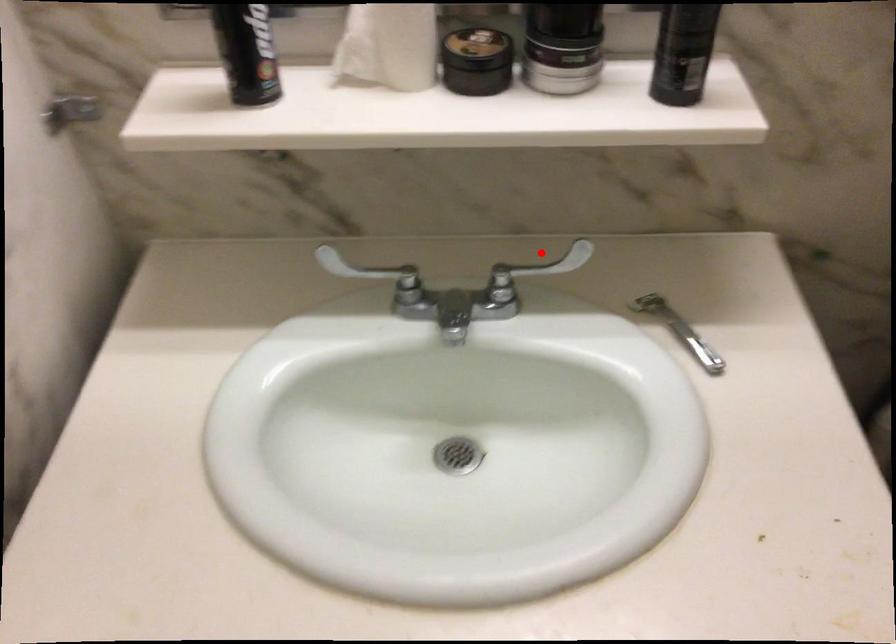
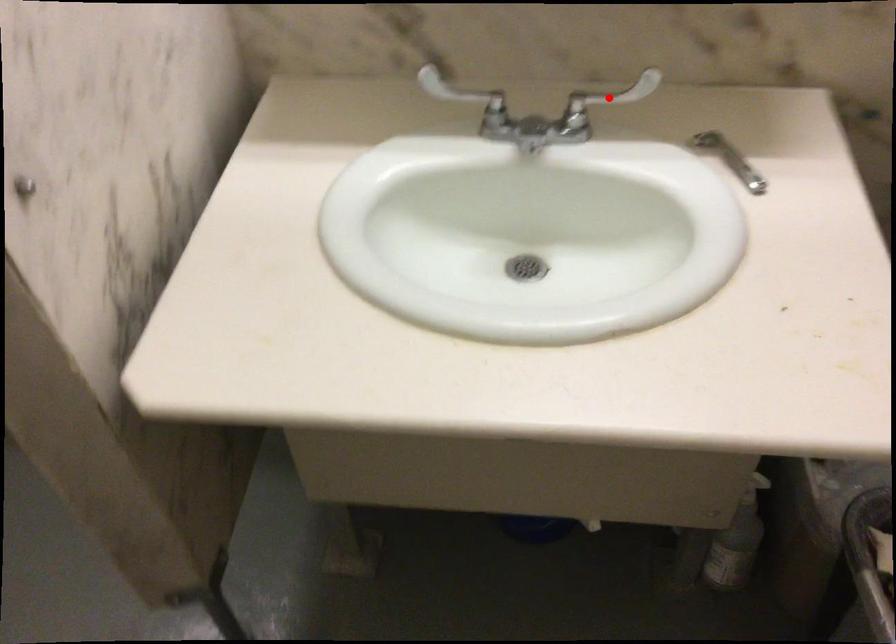
I am providing you with two images of the same scene from different viewpoints. A red point is marked on the first image and another point is marked on the second image. Do the highlighted points in image1 and image2 indicate the same real-world spot?

Yes